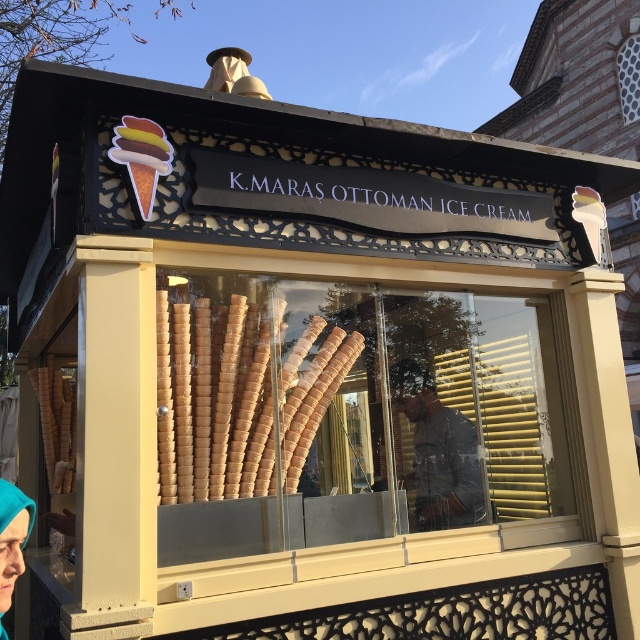
Who is more forward, (243, 369) or (3, 564)?

Point (3, 564) is in front.

Can you confirm if golden waffle cone at center is shorter than teal fabric headscarf at lower left?

No, golden waffle cone at center is not shorter than teal fabric headscarf at lower left.

Is point (212, 458) positioned in front of point (17, 513)?

That is False.

Where is `golden waffle cone at center`? This screenshot has height=640, width=640. golden waffle cone at center is located at coordinates (240, 394).

Is point (212, 362) farther from viewer compared to point (417, 403)?

No, it is in front of (417, 403).

What do you see at coordinates (240, 394) in the screenshot? The height and width of the screenshot is (640, 640). I see `golden waffle cone at center` at bounding box center [240, 394].

Who is more forward, (275,408) or (401,371)?

Point (275,408)

Locate an element on the screen. Image resolution: width=640 pixels, height=640 pixels. golden waffle cone at center is located at coordinates (240, 394).

Does dark gray fabric at center have a lesser width compared to teal fabric headscarf at lower left?

No, dark gray fabric at center is not thinner than teal fabric headscarf at lower left.

Is point (452, 442) less distant than point (3, 596)?

That is False.

The height and width of the screenshot is (640, 640). I want to click on dark gray fabric at center, so click(436, 452).